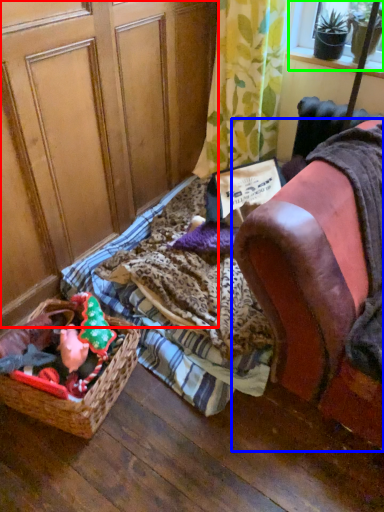
Question: Which object is the closest to the screen door (highlighted by a red box)? Choose among these: furniture (highlighted by a blue box) or window screen (highlighted by a green box).

Choices:
 (A) furniture
 (B) window screen

Answer: (A)